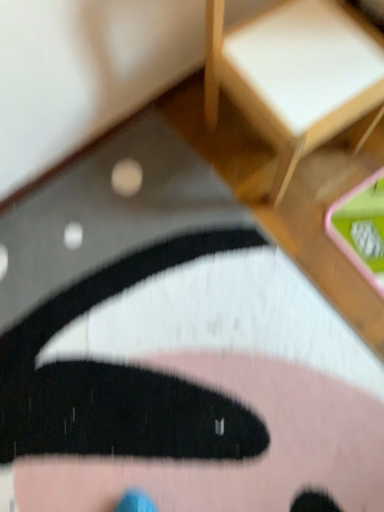
The image size is (384, 512). I want to click on blank space to the left of wooden stool at upper right, so click(174, 160).